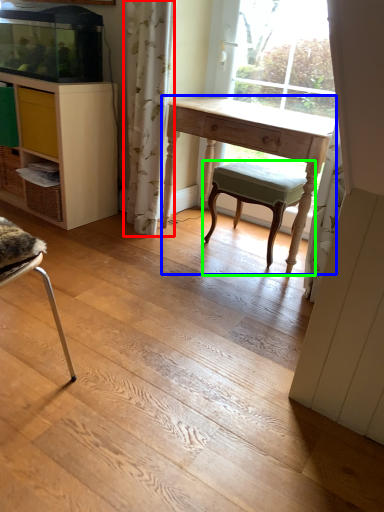
Question: Which is nearer to the curtain (highlighted by a red box)? desk (highlighted by a blue box) or stool (highlighted by a green box).

Choices:
 (A) desk
 (B) stool

Answer: (A)